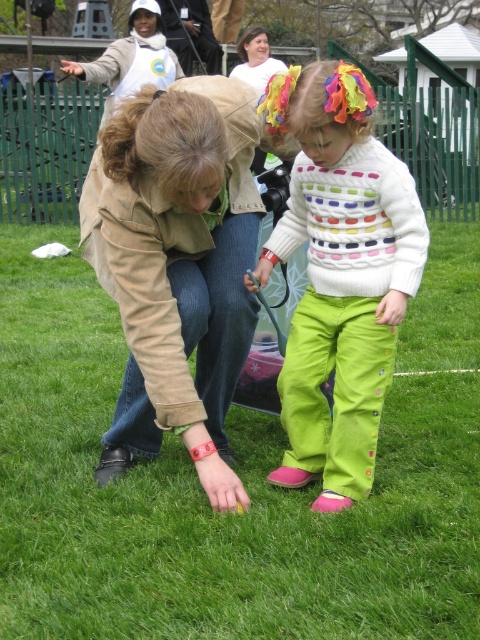
Does white knitted sweater at center have a lesser width compared to white cotton shirt at upper center?

Yes.

Does white knitted sweater at center have a greater width compared to white cotton shirt at upper center?

Incorrect, white knitted sweater at center's width does not surpass white cotton shirt at upper center's.

In order to click on white knitted sweater at center in this screenshot , I will do `click(339, 275)`.

I want to click on green grass at center, so click(206, 500).

Does green grass at center have a greater width compared to white knitted sweater at center?

Yes, green grass at center is wider than white knitted sweater at center.

Between point (467, 321) and point (334, 442), which one is positioned behind?

Point (467, 321)

The height and width of the screenshot is (640, 480). Find the location of `green grass at center`. green grass at center is located at coordinates (206, 500).